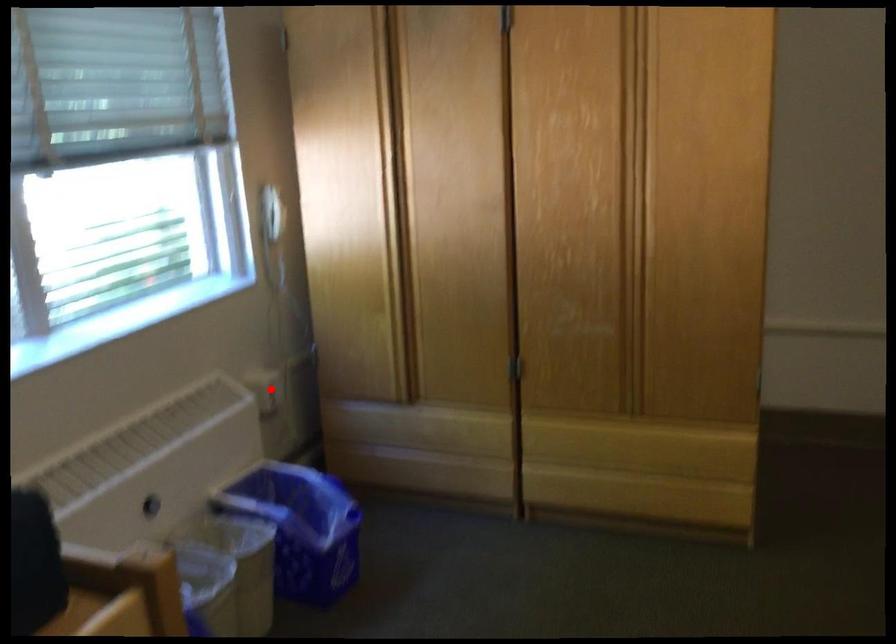
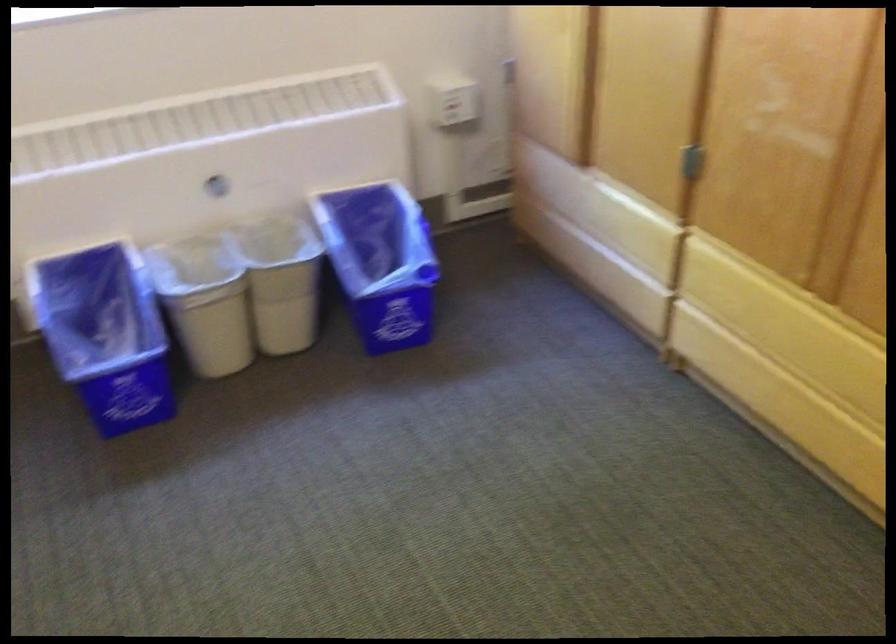
In the second image, find the point that corresponds to the highlighted location in the first image.

(452, 100)